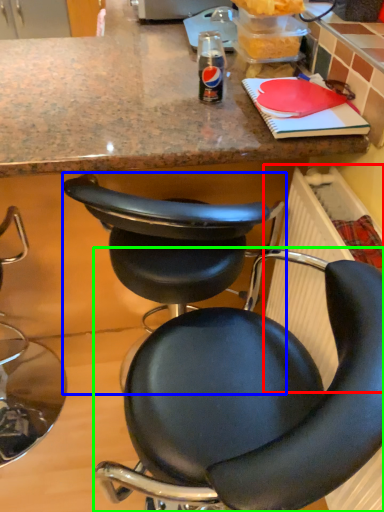
Question: Which is farther away from radiator (highlighted by a red box)? chair (highlighted by a blue box) or chair (highlighted by a green box)?

Choices:
 (A) chair
 (B) chair

Answer: (A)